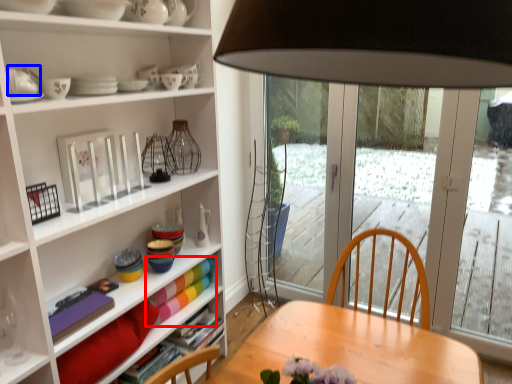
Question: Which point is further to the camera, book (highlighted by a red box) or tableware (highlighted by a blue box)?

Choices:
 (A) book
 (B) tableware

Answer: (A)